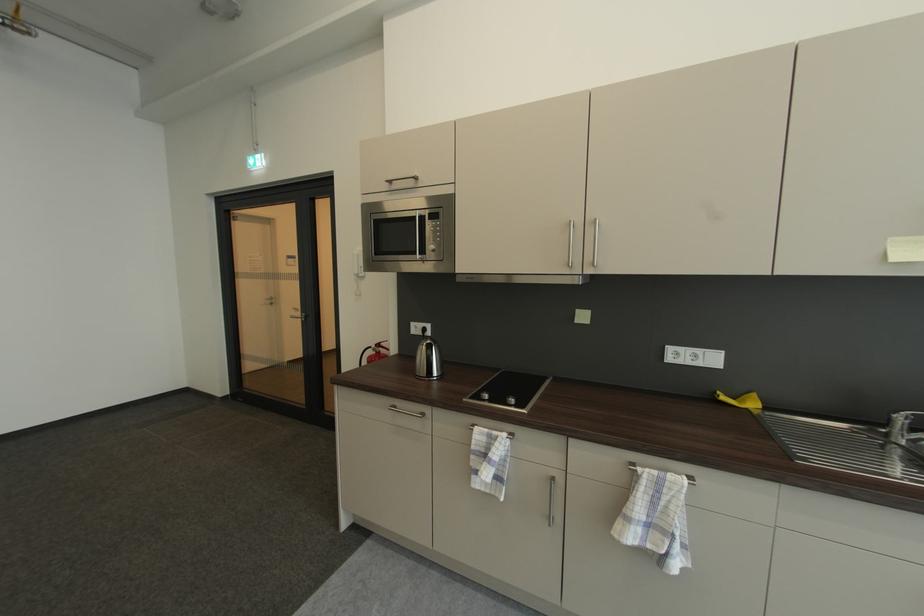
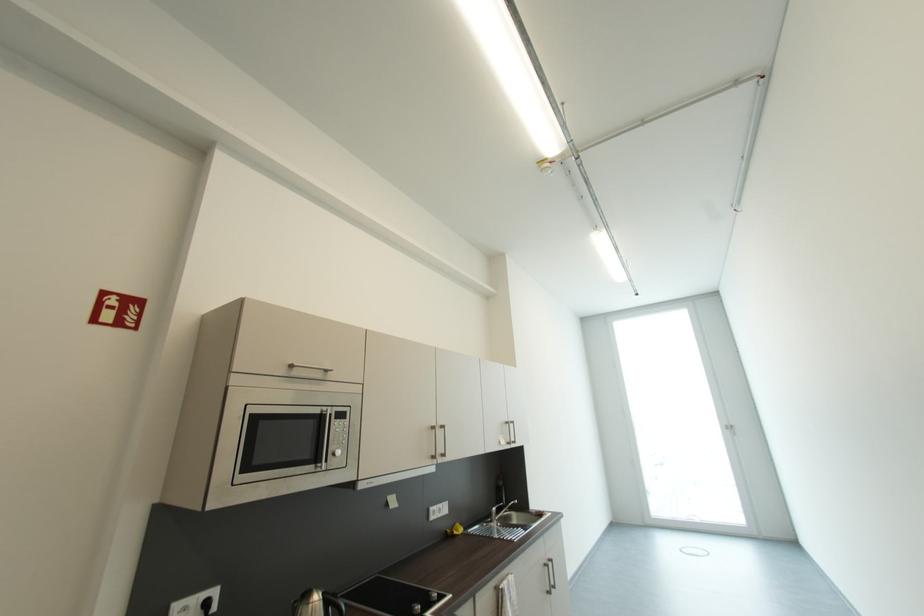
Find the pixel in the second image that matches (436,215) in the first image.

(342, 413)